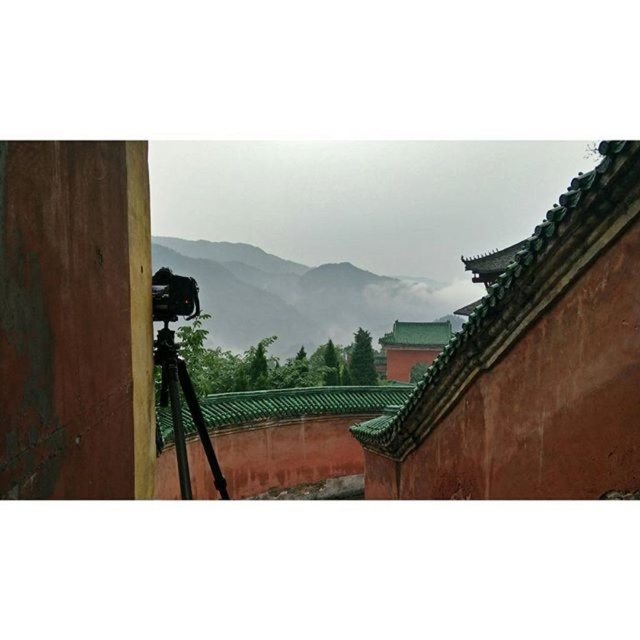
Question: Which object is farther from the camera taking this photo?

Choices:
 (A) green metallic tripod at center
 (B) green matte mountain at center

Answer: (A)

Question: Which object appears closest to the camera in this image?

Choices:
 (A) green metallic tripod at center
 (B) green matte mountain at center

Answer: (B)

Question: Is green matte mountain at center bigger than green metallic tripod at center?

Choices:
 (A) no
 (B) yes

Answer: (B)

Question: In this image, where is green matte mountain at center located relative to green metallic tripod at center?

Choices:
 (A) below
 (B) above

Answer: (A)

Question: Does green metallic tripod at center appear under black plastic camera at lower left?

Choices:
 (A) no
 (B) yes

Answer: (B)

Question: Which of these objects is positioned closest to the green metallic tripod at center?

Choices:
 (A) black plastic camera at lower left
 (B) green matte mountain at center

Answer: (A)